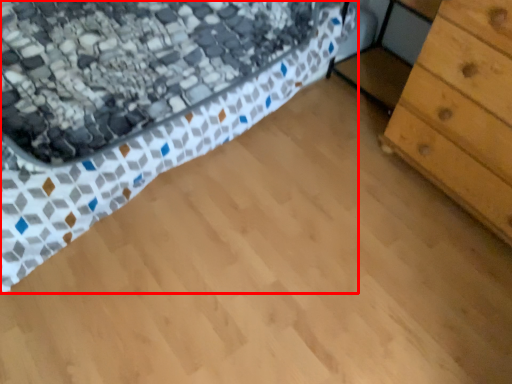
Question: Considering the relative positions of bed (annotated by the red box) and chest of drawers in the image provided, where is bed (annotated by the red box) located with respect to the staircase?

Choices:
 (A) right
 (B) left

Answer: (B)